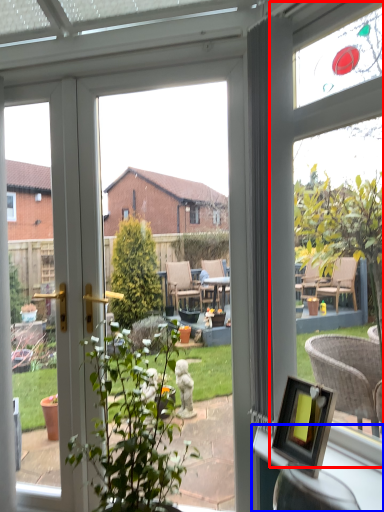
Question: Which object appears farthest to the camera in this image, bay window (highlighted by a red box) or window sill (highlighted by a blue box)?

Choices:
 (A) bay window
 (B) window sill

Answer: (A)